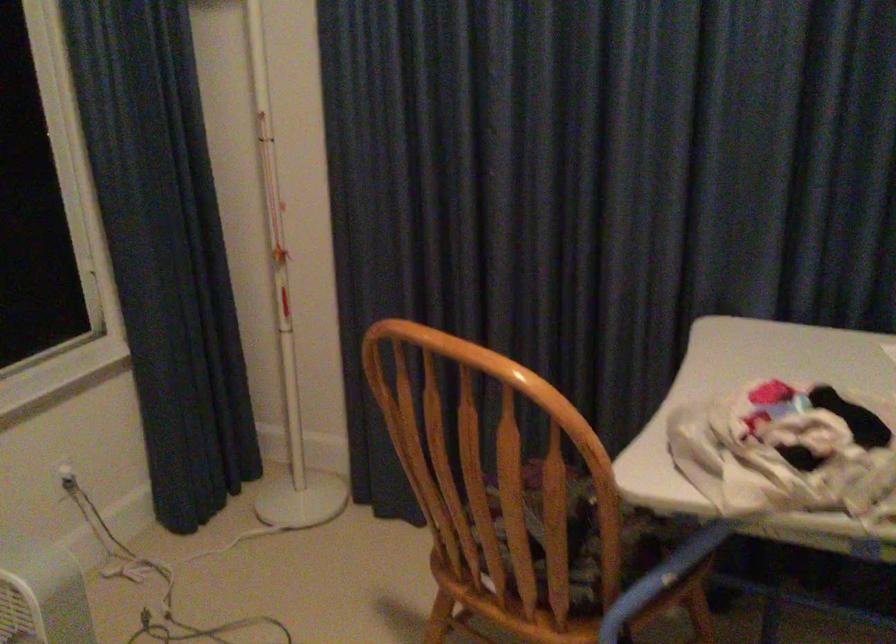
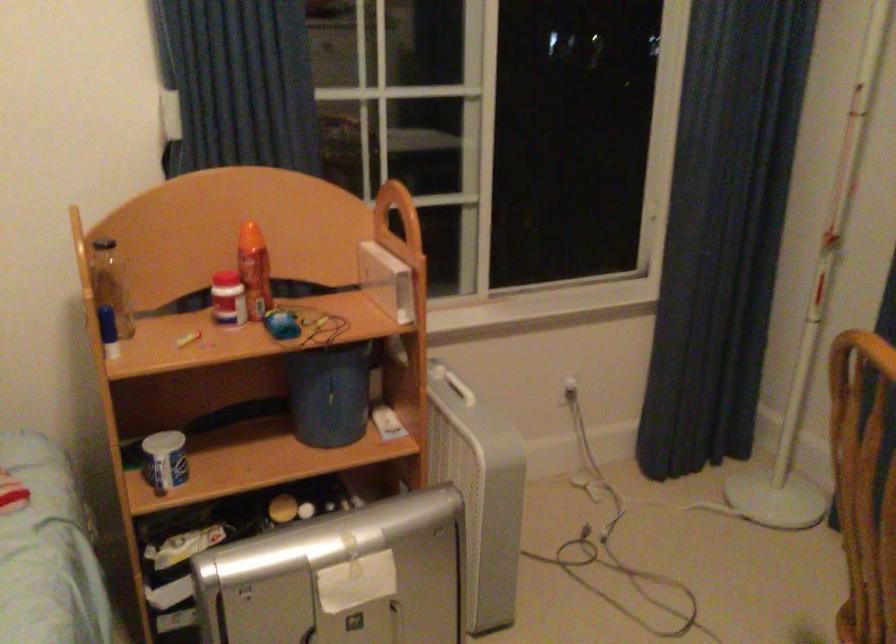
Question: I am providing you with two images of the same scene from different viewpoints. After the viewpoint changes to image2, which objects are now occluded?

Choices:
 (A) blue soda can
 (B) blue bucket
 (C) wooden chair armrest
 (D) white window latch

Answer: (D)